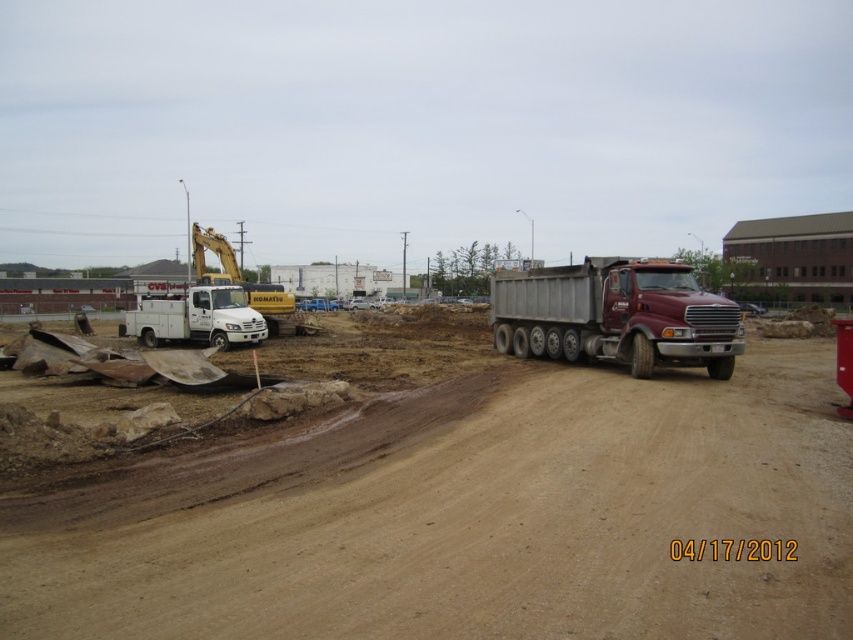
You are a construction worker who needs to move heavy equipment from the white matte utility truck at left to the maroon metallic dump truck at right. Considering their sizes, which truck can accommodate more equipment?

The maroon metallic dump truck at right is larger in size than the white matte utility truck at left, so it can accommodate more equipment.

You are a construction worker who needs to park a new vehicle between the maroon metallic dump truck at right and the white matte utility truck at left. Considering their heights, which truck should you place closer to the ground to ensure proper clearance?

The white matte utility truck at left is shorter than the maroon metallic dump truck at right, so you should place the white matte utility truck at left closer to the ground to ensure proper clearance.